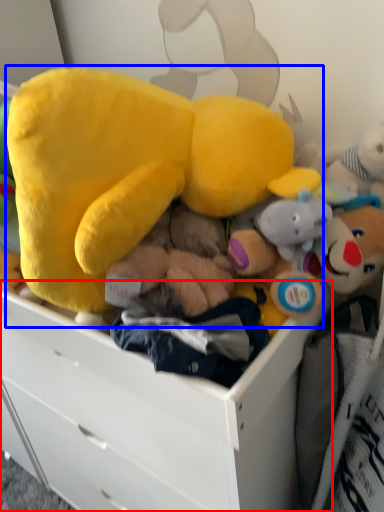
Question: Among these objects, which one is nearest to the camera, drawer (highlighted by a red box) or toy (highlighted by a blue box)?

Choices:
 (A) drawer
 (B) toy

Answer: (B)